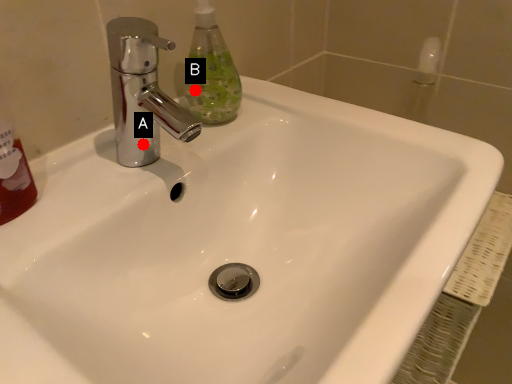
Question: Two points are circled on the image, labeled by A and B beside each circle. Which point is closer to the camera taking this photo?

Choices:
 (A) A is closer
 (B) B is closer

Answer: (A)